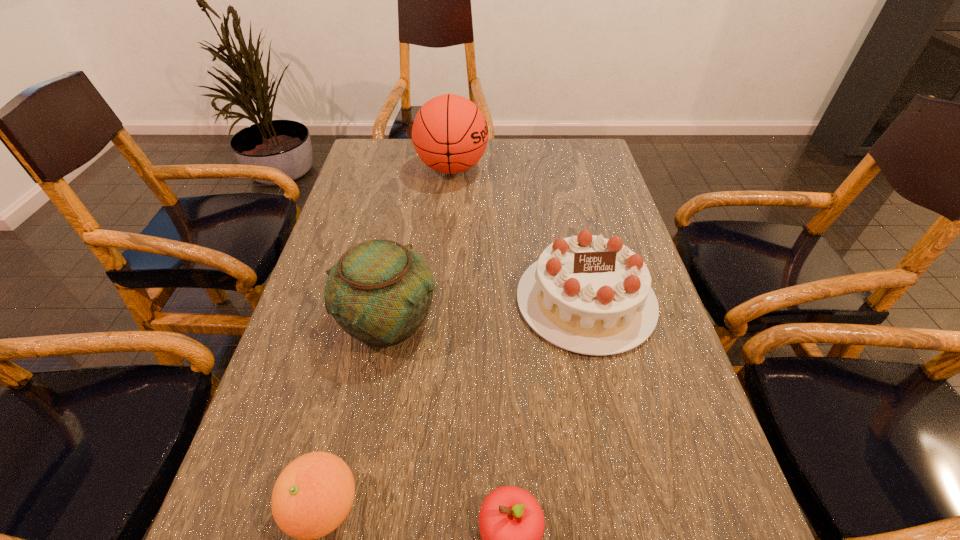
At what (x,y) coordinates should I click in order to perform the action: click on the tallest object. Please return your answer as a coordinate pair (x, y). This screenshot has height=540, width=960. Looking at the image, I should click on (450, 134).

Image resolution: width=960 pixels, height=540 pixels. I want to click on basketball, so click(x=450, y=134).

The image size is (960, 540). I want to click on pottery, so click(379, 292).

The width and height of the screenshot is (960, 540). I want to click on birthday cake, so click(587, 294).

Locate an element on the screen. Image resolution: width=960 pixels, height=540 pixels. vacant region located on the side with logo of the tallest object is located at coordinates (555, 168).

I want to click on vacant region located on the left of the pottery, so pyautogui.click(x=313, y=320).

Identify the location of vacant region located 0.120m on the left of the birthday cake. (464, 300).

The image size is (960, 540). Find the location of `object at the far edge`. object at the far edge is located at coordinates (450, 134).

I want to click on object present at the left edge, so click(x=379, y=292).

Locate an element on the screen. object that is positioned at the right edge is located at coordinates (587, 294).